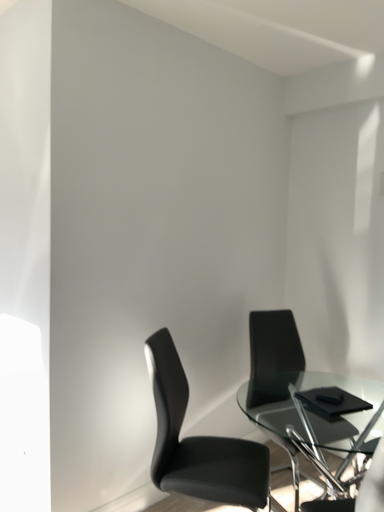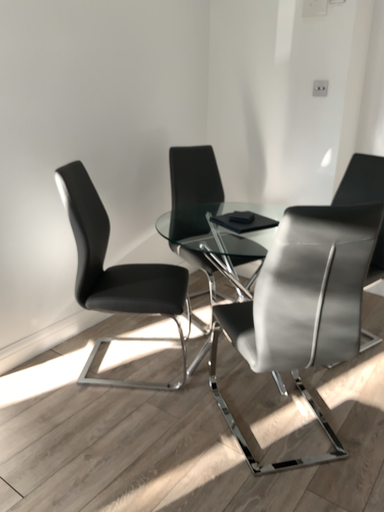
Question: How did the camera likely rotate when shooting the video?

Choices:
 (A) rotated downward
 (B) rotated upward

Answer: (A)